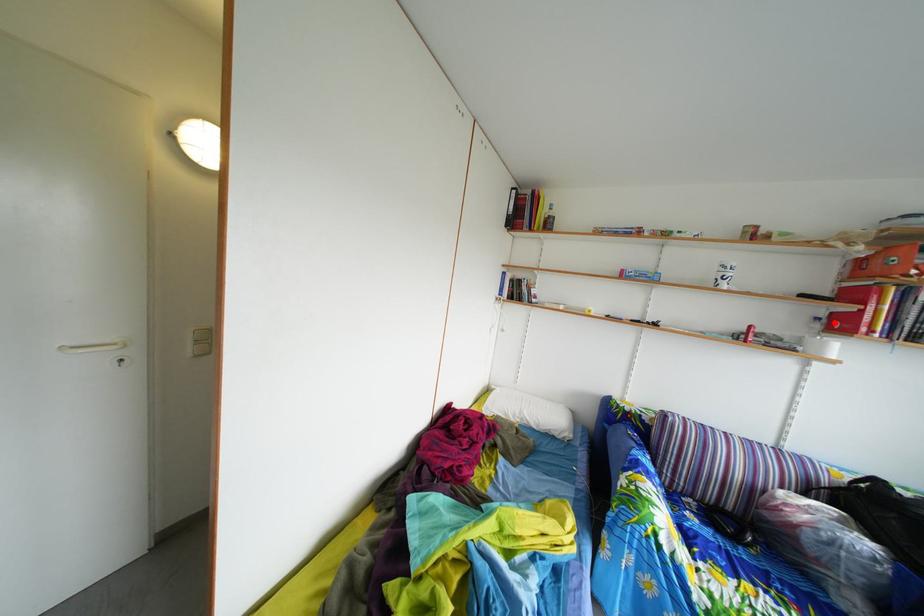
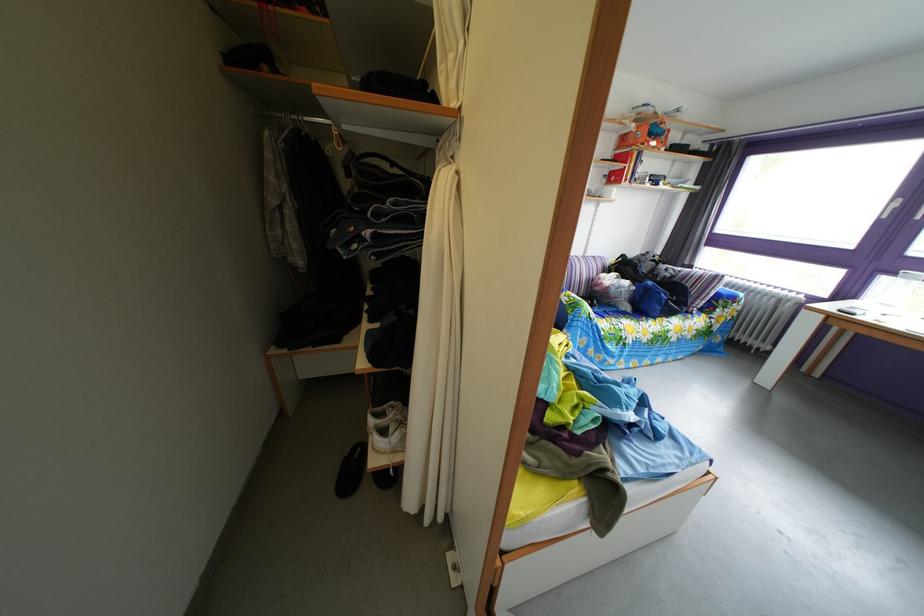
Question: I am providing you with two images of the same scene from different viewpoints. Given a red point in image1, look at the same physical point in image2. Is it:

Choices:
 (A) Closer to the viewpoint
 (B) Farther from the viewpoint

Answer: (A)